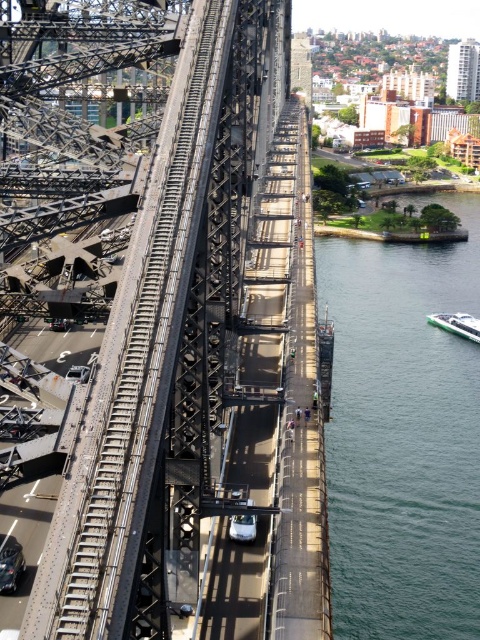
What do you see at coordinates (403, 436) in the screenshot? I see `green water at lower right` at bounding box center [403, 436].

Which is above, green water at lower right or white glossy boat at lower right?

white glossy boat at lower right

Does point (355, 301) come behind point (437, 317)?

Yes, it is behind point (437, 317).

Locate an element on the screen. This screenshot has height=640, width=480. green water at lower right is located at coordinates (403, 436).

Does point (189, 122) come in front of point (441, 324)?

Yes.

Which is above, black steel bridge at center or white glossy boat at lower right?

black steel bridge at center is higher up.

Locate an element on the screen. black steel bridge at center is located at coordinates (166, 321).

This screenshot has height=640, width=480. What do you see at coordinates (166, 321) in the screenshot? I see `black steel bridge at center` at bounding box center [166, 321].

Where is `black steel bridge at center`? black steel bridge at center is located at coordinates (166, 321).

Identify the location of black steel bridge at center. This screenshot has width=480, height=640. (166, 321).